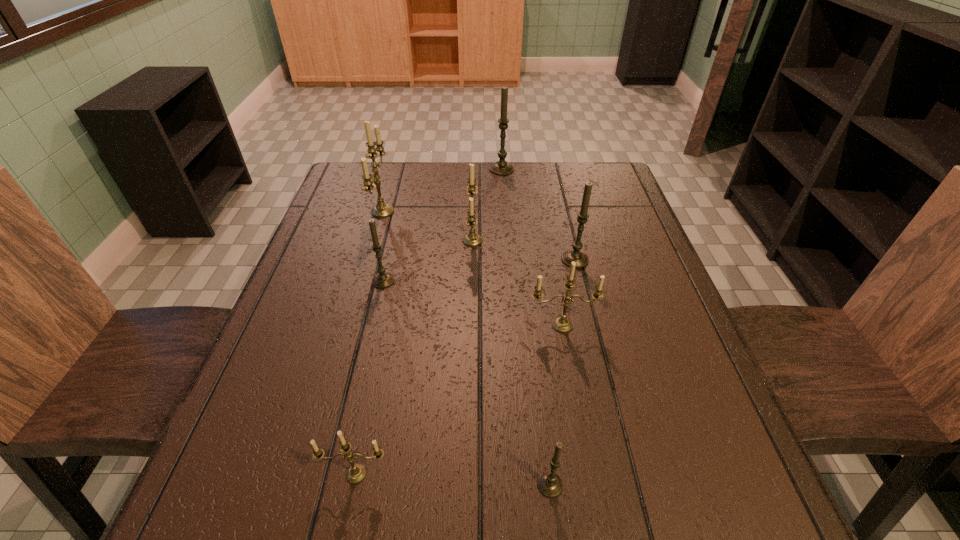
At what (x,y) coordinates should I click in order to perform the action: click on object that is the third closest to the third nearest gray candle. Please return your answer as a coordinate pair (x, y). The width and height of the screenshot is (960, 540). Looking at the image, I should click on (501, 167).

Choose which candle is the fifth nearest neighbor to the second nearest gray candle. Please provide its 2D coordinates. Your answer should be formatted as a tuple, i.e. [(x, y)], where the tuple contains the x and y coordinates of a point satisfying the conditions above.

[(356, 473)]

Locate which candle is the third closest to the nearest gray candle. Please provide its 2D coordinates. Your answer should be formatted as a tuple, i.e. [(x, y)], where the tuple contains the x and y coordinates of a point satisfying the conditions above.

[(581, 259)]

Locate an element on the screen. This screenshot has width=960, height=540. the closest gray candle relative to the nearest metallic candle is located at coordinates (549, 483).

This screenshot has height=540, width=960. I want to click on gray candle that stands as the third closest to the rightmost gray candle, so click(549, 483).

Image resolution: width=960 pixels, height=540 pixels. I want to click on metallic candle that is the third nearest to the nearest metallic candle, so click(381, 210).

Select which metallic candle appears as the closest to the nearest gray candle. Please provide its 2D coordinates. Your answer should be formatted as a tuple, i.e. [(x, y)], where the tuple contains the x and y coordinates of a point satisfying the conditions above.

[(356, 473)]

Locate an element on the screen. This screenshot has width=960, height=540. free space that satisfies the following two spatial constraints: 1. on the back side of the third nearest gray candle; 2. on the left side of the nearest gray candle is located at coordinates (524, 259).

Where is `vacant region that satisfies the following two spatial constraints: 1. on the front side of the biggest gray candle; 2. on the right side of the nearest gray candle`? The image size is (960, 540). vacant region that satisfies the following two spatial constraints: 1. on the front side of the biggest gray candle; 2. on the right side of the nearest gray candle is located at coordinates (524, 484).